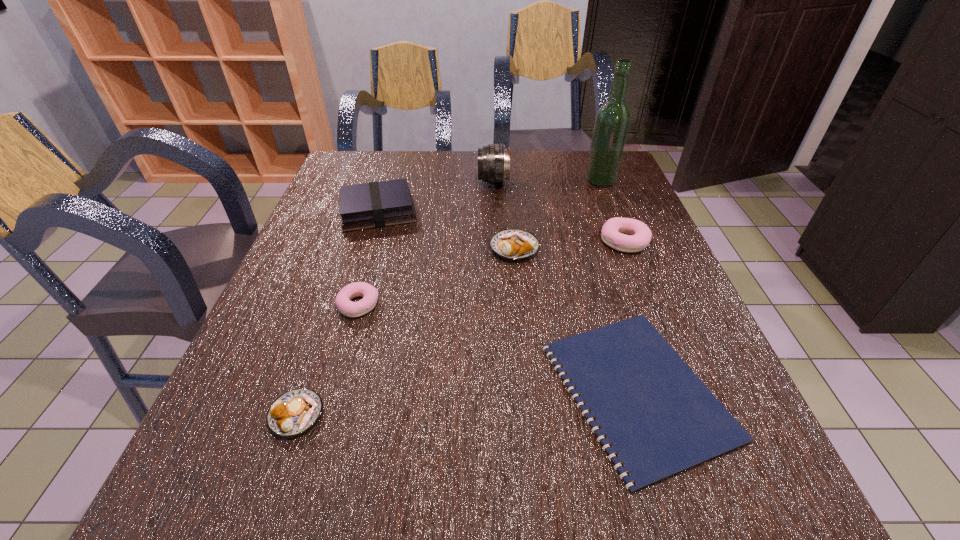
Image resolution: width=960 pixels, height=540 pixels. Identify the location of pastry present at the right edge. (639, 237).

Where is `notepad situated at the right edge`? The image size is (960, 540). notepad situated at the right edge is located at coordinates (x=660, y=419).

Where is `object at the far right corner`? The height and width of the screenshot is (540, 960). object at the far right corner is located at coordinates (612, 121).

What are the coordinates of `object present at the near right corner` in the screenshot? It's located at (660, 419).

Image resolution: width=960 pixels, height=540 pixels. In order to click on vacant region at the far edge in this screenshot , I will do `click(429, 177)`.

The image size is (960, 540). In the image, there is a desktop. Identify the location of vacant region at the near edge. (662, 493).

At what (x,y) coordinates should I click in order to perform the action: click on vacant space at the left edge of the desktop. Please return your answer as a coordinate pair (x, y). Image resolution: width=960 pixels, height=540 pixels. Looking at the image, I should click on (339, 217).

In the image, there is a desktop. At what (x,y) coordinates should I click in order to perform the action: click on vacant region at the right edge. Please return your answer as a coordinate pair (x, y). This screenshot has width=960, height=540. Looking at the image, I should click on coord(660,263).

This screenshot has width=960, height=540. Find the location of `vacant region at the far left corner of the desktop`. vacant region at the far left corner of the desktop is located at coordinates (372, 158).

Image resolution: width=960 pixels, height=540 pixels. Identify the location of vacant space at the far right corner of the desktop. (624, 166).